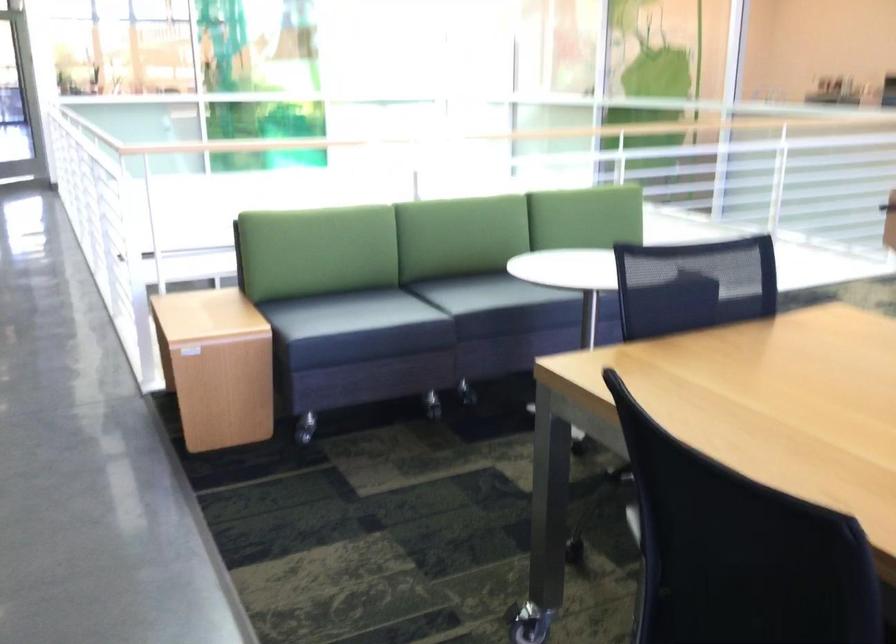
Where would you grasp the railing handrail? Please return your answer as a coordinate pair (x, y).

(503, 135)